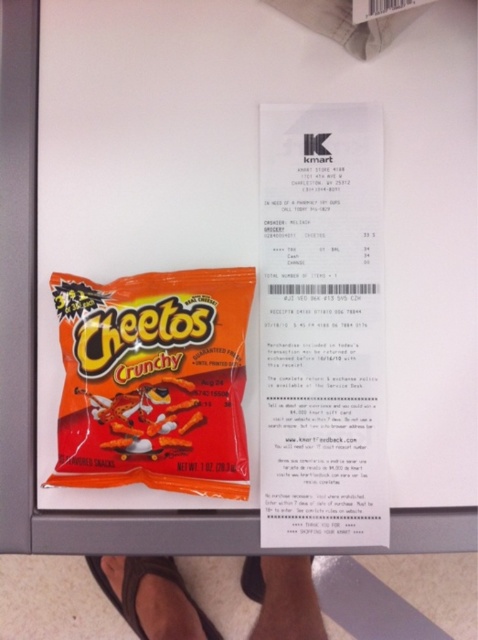
You are organizing items on a shelf and need to know which item is taller between the orange matte cheetos crunchy at center and the black rubber sandal at lower center. Based on the scene, can you determine which one is taller?

The orange matte cheetos crunchy at center is shorter than the black rubber sandal at lower center, so the black rubber sandal at lower center is taller.

You are holding a camera and want to take a closeup shot of the orange matte cheetos crunchy at center. The camera requires the subject to be at least 24 inches away to focus properly. Can you take the photo without moving the cheetos?

The orange matte cheetos crunchy at center is currently 24.44 inches away from the camera, which is just over the minimum required distance of 24 inches. Therefore, you can take the photo without moving the cheetos.